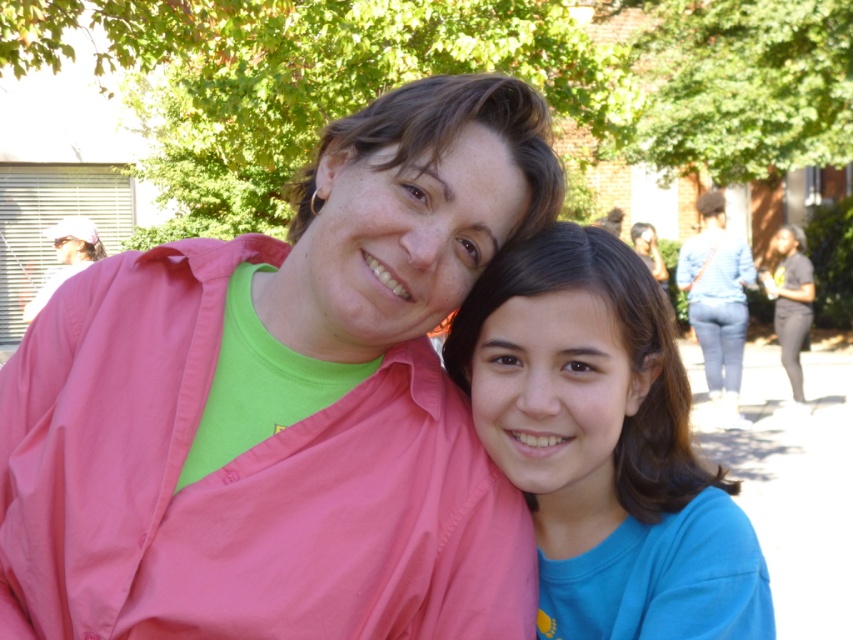
Does blue jeans at right have a lesser width compared to black matte shirt at right?

Yes.

Can you confirm if blue jeans at right is positioned below black matte shirt at right?

Yes.

What do you see at coordinates (717, 305) in the screenshot? I see `blue jeans at right` at bounding box center [717, 305].

In order to click on blue jeans at right in this screenshot , I will do `click(717, 305)`.

Can you confirm if pink cotton shirt at center is positioned to the left of blue cotton shirt at center?

Indeed, pink cotton shirt at center is positioned on the left side of blue cotton shirt at center.

Consider the image. Who is taller, pink cotton shirt at center or blue cotton shirt at center?

With more height is pink cotton shirt at center.

Is point (303, 493) positioned before point (556, 444)?

Yes, it is in front of point (556, 444).

Where is `pink cotton shirt at center`? This screenshot has height=640, width=853. pink cotton shirt at center is located at coordinates (283, 404).

Which is more to the right, blue cotton shirt at center or blue jeans at right?

From the viewer's perspective, blue jeans at right appears more on the right side.

Identify the location of blue cotton shirt at center. The image size is (853, 640). (602, 445).